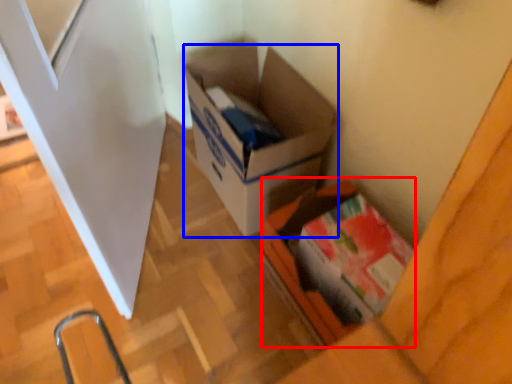
Question: Which object appears farthest to the camera in this image, box (highlighted by a red box) or box (highlighted by a blue box)?

Choices:
 (A) box
 (B) box

Answer: (B)